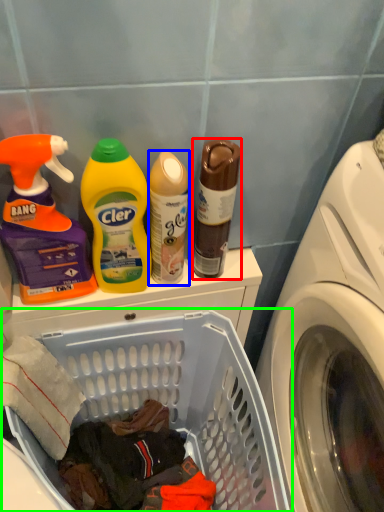
Question: Which is nearer to the bottle (highlighted by a red box)? cleaning product (highlighted by a blue box) or laundry basket (highlighted by a green box).

Choices:
 (A) cleaning product
 (B) laundry basket

Answer: (A)